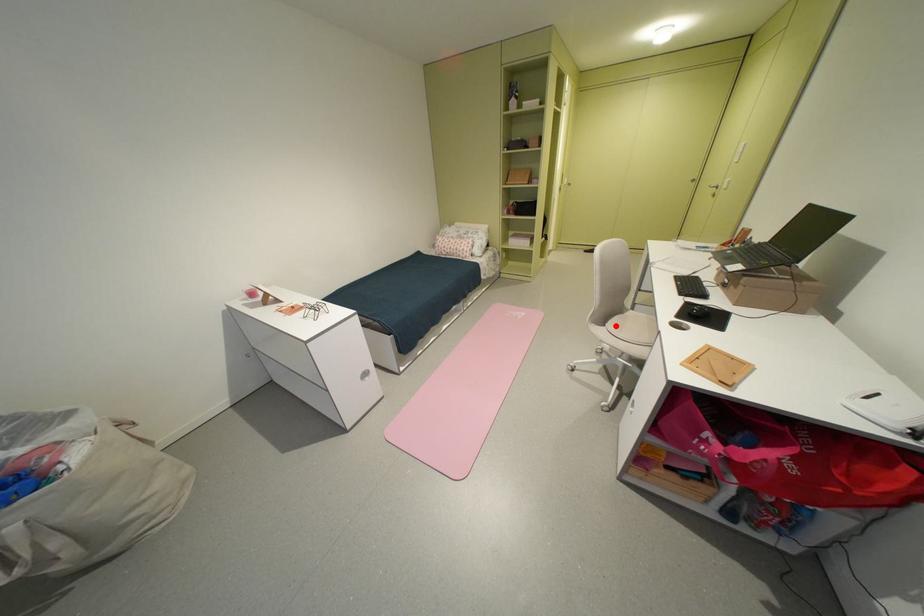
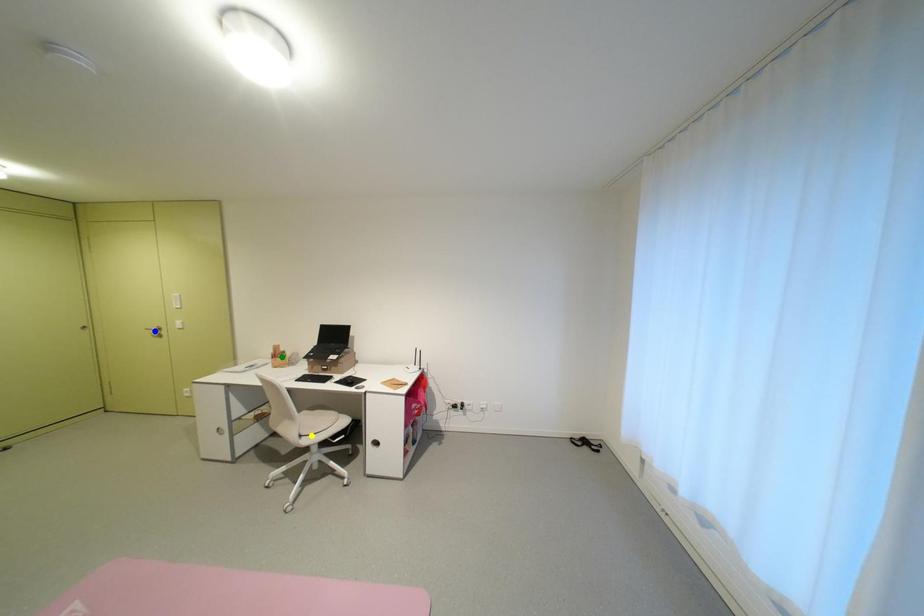
Question: I am providing you with two images of the same scene from different viewpoints. A red point is marked on the first image. You are given multiple points on the second image. Which point in image 2 represents the same 3d spot as the red point in image 1?

Choices:
 (A) blue point
 (B) green point
 (C) yellow point

Answer: (C)